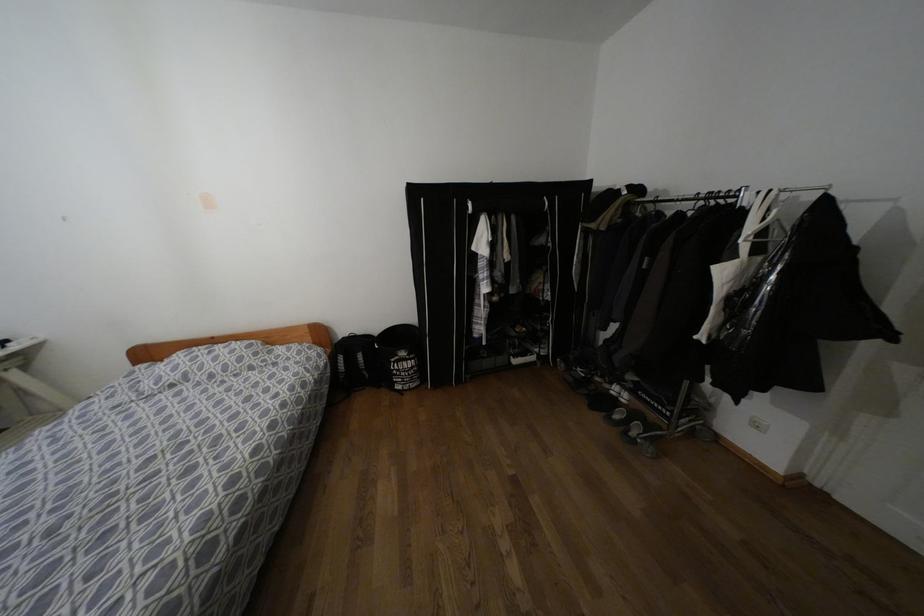
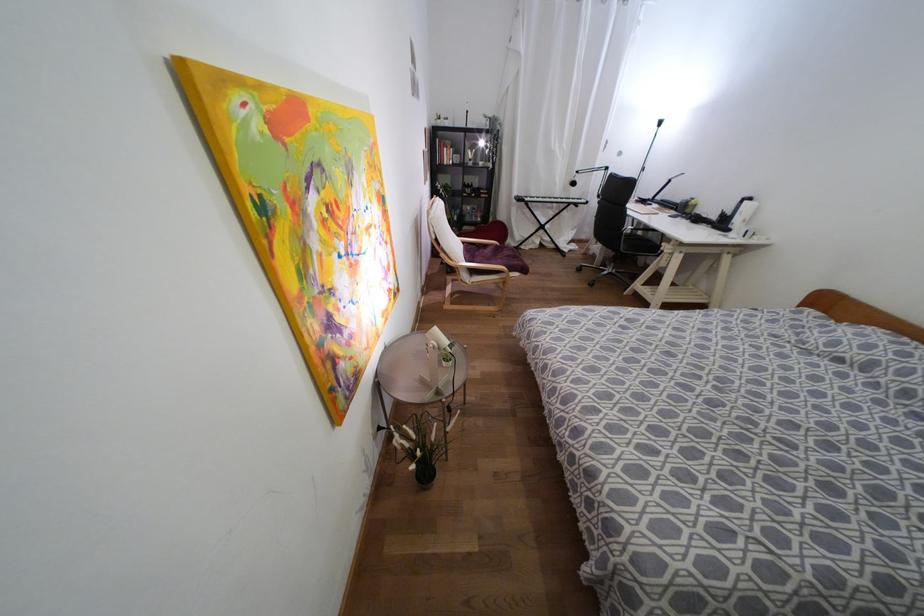
The first image is from the beginning of the video and the second image is from the end. How did the camera likely rotate when shooting the video?

The camera rotated toward left-down.